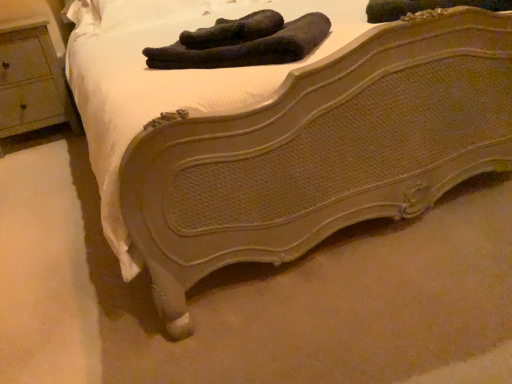
Question: Is wooden nightstand at left far away from dark green fabric socks at upper center, the 1th footwear from the left?

Choices:
 (A) no
 (B) yes

Answer: (B)

Question: Can you confirm if wooden nightstand at left is wider than dark green fabric socks at upper center, the 1th footwear from the left?

Choices:
 (A) yes
 (B) no

Answer: (A)

Question: Is wooden nightstand at left outside of dark green fabric socks at upper center, which is the second footwear from right to left?

Choices:
 (A) yes
 (B) no

Answer: (A)

Question: Is wooden nightstand at left turned away from dark green fabric socks at upper center, the 1th footwear from the left?

Choices:
 (A) yes
 (B) no

Answer: (B)

Question: From the image's perspective, is wooden nightstand at left located above dark green fabric socks at upper center, which is the second footwear from right to left?

Choices:
 (A) yes
 (B) no

Answer: (A)

Question: Does wooden nightstand at left have a greater height compared to dark green fabric socks at upper center, which is the second footwear from right to left?

Choices:
 (A) yes
 (B) no

Answer: (A)

Question: Considering the relative sizes of wooden nightstand at left and black fuzzy socks at center, the first footwear when ordered from right to left, in the image provided, is wooden nightstand at left wider than black fuzzy socks at center, the first footwear when ordered from right to left,?

Choices:
 (A) no
 (B) yes

Answer: (B)

Question: Can you confirm if wooden nightstand at left is positioned to the right of black fuzzy socks at center, placed as the second footwear when sorted from left to right?

Choices:
 (A) yes
 (B) no

Answer: (B)

Question: Does wooden nightstand at left turn towards black fuzzy socks at center, placed as the second footwear when sorted from left to right?

Choices:
 (A) yes
 (B) no

Answer: (B)

Question: Does wooden nightstand at left have a greater height compared to black fuzzy socks at center, placed as the second footwear when sorted from left to right?

Choices:
 (A) no
 (B) yes

Answer: (B)

Question: Is wooden nightstand at left behind black fuzzy socks at center, the first footwear when ordered from right to left?

Choices:
 (A) no
 (B) yes

Answer: (B)

Question: From a real-world perspective, is wooden nightstand at left on black fuzzy socks at center, placed as the second footwear when sorted from left to right?

Choices:
 (A) yes
 (B) no

Answer: (B)

Question: Is black fuzzy socks at center, the first footwear when ordered from right to left, surrounding wooden nightstand at left?

Choices:
 (A) no
 (B) yes

Answer: (A)